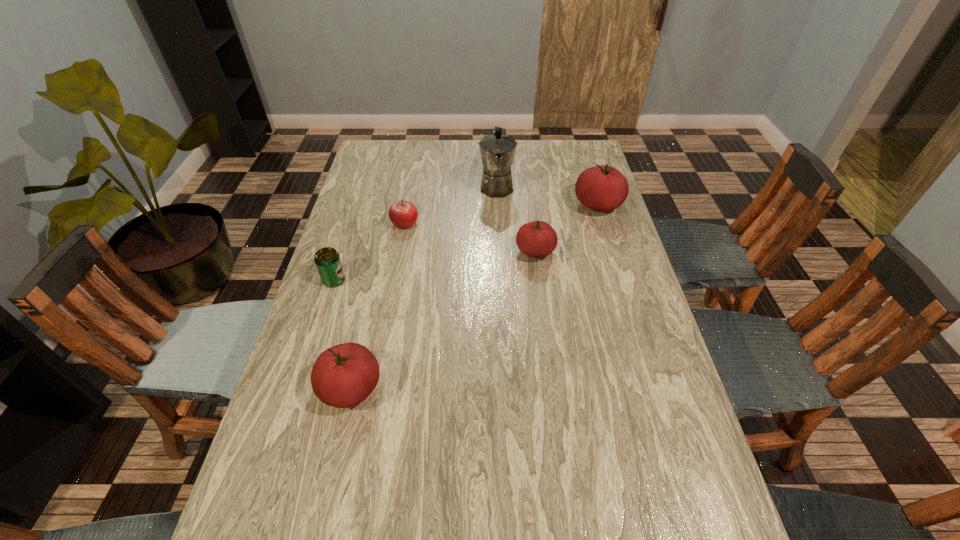
The width and height of the screenshot is (960, 540). What are the coordinates of `the nearest tomato` in the screenshot? It's located at (344, 375).

At what (x,y) coordinates should I click in order to perform the action: click on the leftmost tomato. Please return your answer as a coordinate pair (x, y). Looking at the image, I should click on (344, 375).

Where is `the third nearest object`? The height and width of the screenshot is (540, 960). the third nearest object is located at coordinates (537, 239).

You are a GUI agent. You are given a task and a screenshot of the screen. Output one action in this format:
    pyautogui.click(x=<x>, y=<y>)
    Task: Click on the second nearest tomato
    
    Given the screenshot: What is the action you would take?
    pyautogui.click(x=537, y=239)

Locate an element on the screen. the rightmost object is located at coordinates (602, 188).

I want to click on the rightmost tomato, so click(x=602, y=188).

What are the coordinates of `the tallest object` in the screenshot? It's located at (497, 151).

Locate an element on the screen. The image size is (960, 540). the shortest object is located at coordinates (403, 214).

Locate an element on the screen. The image size is (960, 540). the leftmost object is located at coordinates (327, 260).

Where is `beer can`? This screenshot has height=540, width=960. beer can is located at coordinates (327, 260).